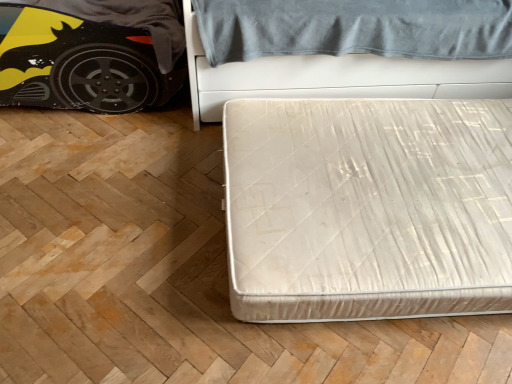
This screenshot has width=512, height=384. In order to click on vacant space in front of matt black car at left in this screenshot , I will do `click(98, 195)`.